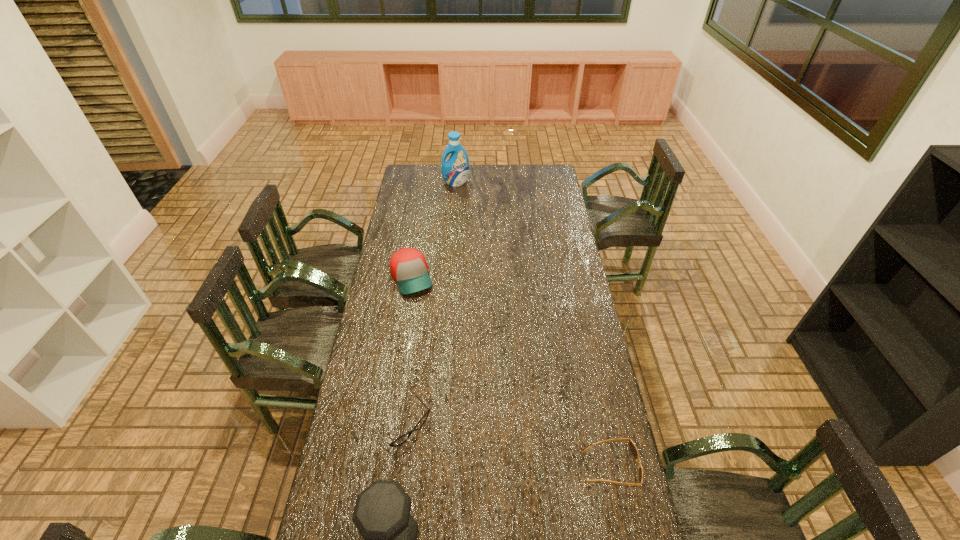
Locate an element on the screen. This screenshot has width=960, height=540. free space on the desktop that is between the dumbbell and the shortest object and is positioned at the brim of the third tallest object is located at coordinates (509, 501).

Identify the location of vacant spot on the desktop that is between the fourth shortest object and the sunglasses and is positioned on the front-facing side of the spectacles. Image resolution: width=960 pixels, height=540 pixels. (487, 508).

Locate an element on the screen. vacant space on the desktop that is between the fourth shortest object and the rightmost object and is positioned on the front-facing side of the tallest object is located at coordinates (533, 493).